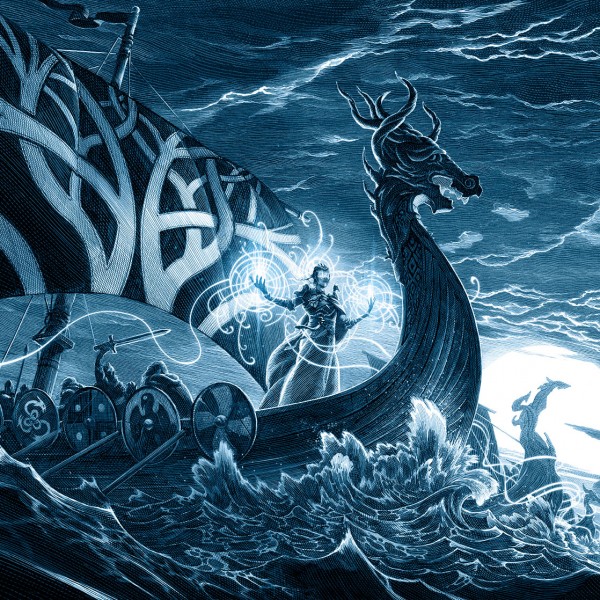
Locate an element on the screen. The image size is (600, 600). light blue lighting is located at coordinates (371, 286), (255, 270), (321, 254).